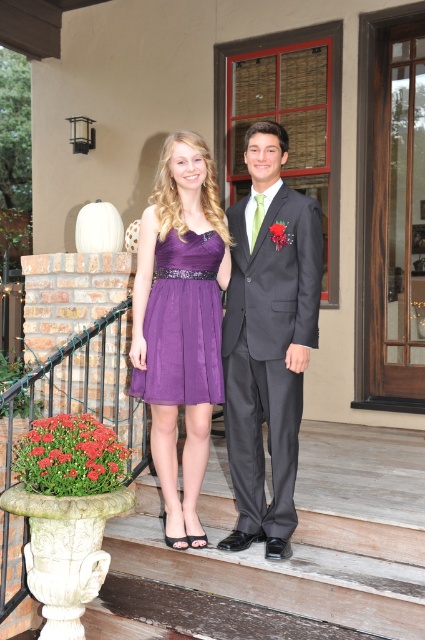
Question: Which point is farther to the camera?

Choices:
 (A) (201, 266)
 (B) (248, 515)

Answer: (B)

Question: Based on their relative distances, which object is farther from the purple satin dress at center?

Choices:
 (A) purple chiffon dress at center
 (B) charcoal gray suit at center

Answer: (B)

Question: Does charcoal gray suit at center lie behind purple satin dress at center?

Choices:
 (A) yes
 (B) no

Answer: (B)

Question: Which point is farther to the camera?

Choices:
 (A) (286, 205)
 (B) (195, 272)
 (C) (161, 358)

Answer: (B)

Question: Is purple satin dress at center bigger than purple chiffon dress at center?

Choices:
 (A) yes
 (B) no

Answer: (A)

Question: Does charcoal gray suit at center lie behind purple satin dress at center?

Choices:
 (A) no
 (B) yes

Answer: (A)